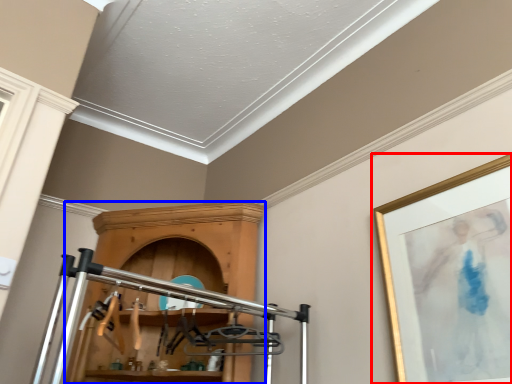
Question: Among these objects, which one is nearest to the camera, picture frame (highlighted by a red box) or furniture (highlighted by a blue box)?

Choices:
 (A) picture frame
 (B) furniture

Answer: (A)